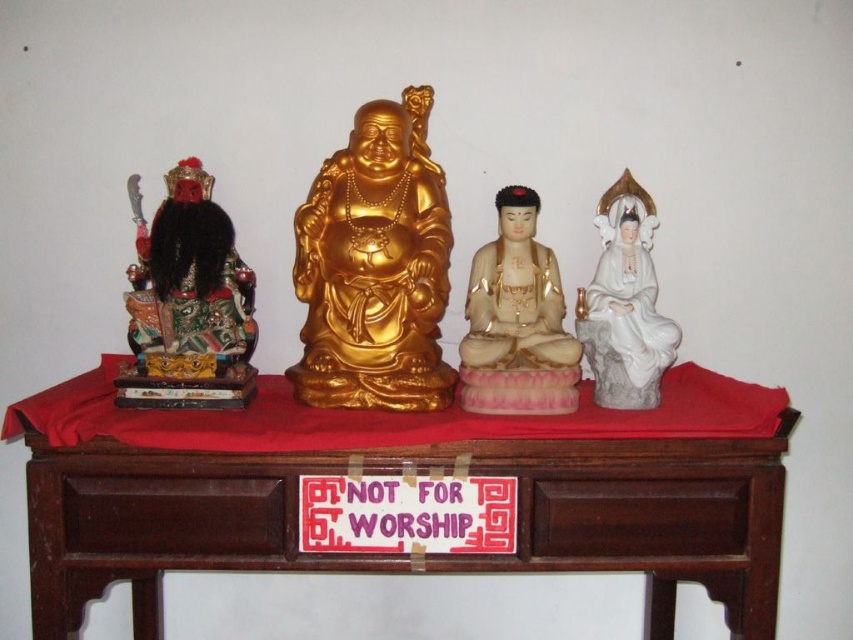
Which is behind, point (228, 454) or point (535, 202)?

Point (535, 202)

Which is in front, point (386, 449) or point (473, 288)?

Positioned in front is point (386, 449).

Which is behind, point (718, 554) or point (485, 404)?

The point (485, 404) is more distant.

Find the location of `mahogany wood table at center`. mahogany wood table at center is located at coordinates (399, 474).

At what (x,y) coordinates should I click in order to perform the action: click on multicolored painted wood statue at left. Please return your answer as a coordinate pair (x, y). This screenshot has width=853, height=640. Looking at the image, I should click on (187, 301).

Which is in front, point (224, 227) or point (602, 196)?

Point (224, 227) is more forward.

Identify the location of multicolored painted wood statue at left. (187, 301).

From the picture: Which is more to the left, multicolored painted wood statue at left or white porcelain statue at center?

multicolored painted wood statue at left

Is multicolored painted wood statue at left wider than white porcelain statue at center?

Correct, the width of multicolored painted wood statue at left exceeds that of white porcelain statue at center.

Is point (190, 240) closer to viewer compared to point (509, 321)?

Yes, point (190, 240) is in front of point (509, 321).

This screenshot has height=640, width=853. I want to click on multicolored painted wood statue at left, so click(187, 301).